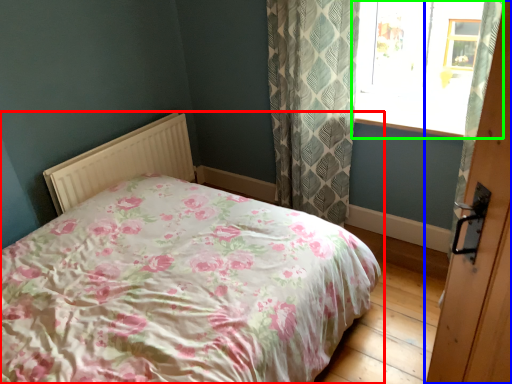
Question: Which is nearer to the bed (highlighted by a red box)? door (highlighted by a blue box) or window (highlighted by a green box).

Choices:
 (A) door
 (B) window

Answer: (A)